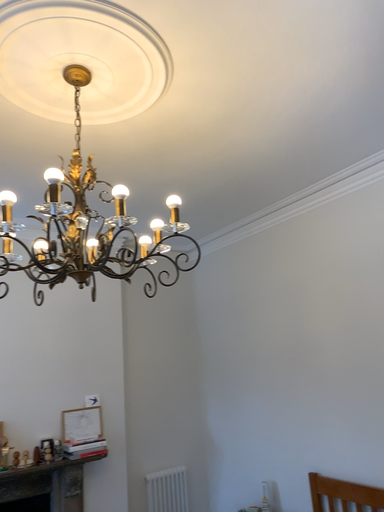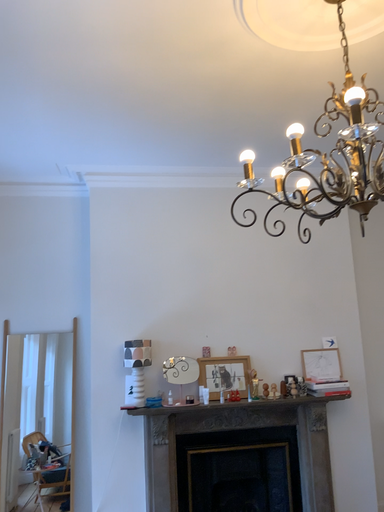
Question: Which way did the camera rotate in the video?

Choices:
 (A) rotated upward
 (B) rotated downward

Answer: (B)